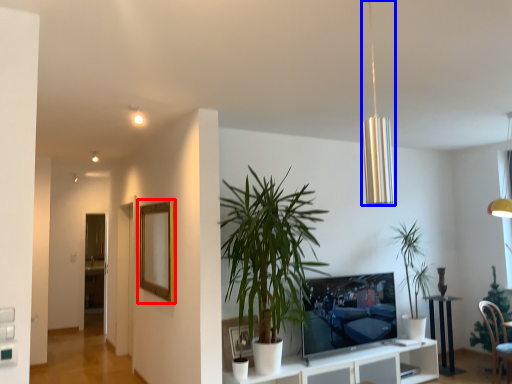
Question: Which object is closer to the camera taking this photo, picture frame (highlighted by a red box) or lamp (highlighted by a blue box)?

Choices:
 (A) picture frame
 (B) lamp

Answer: (B)